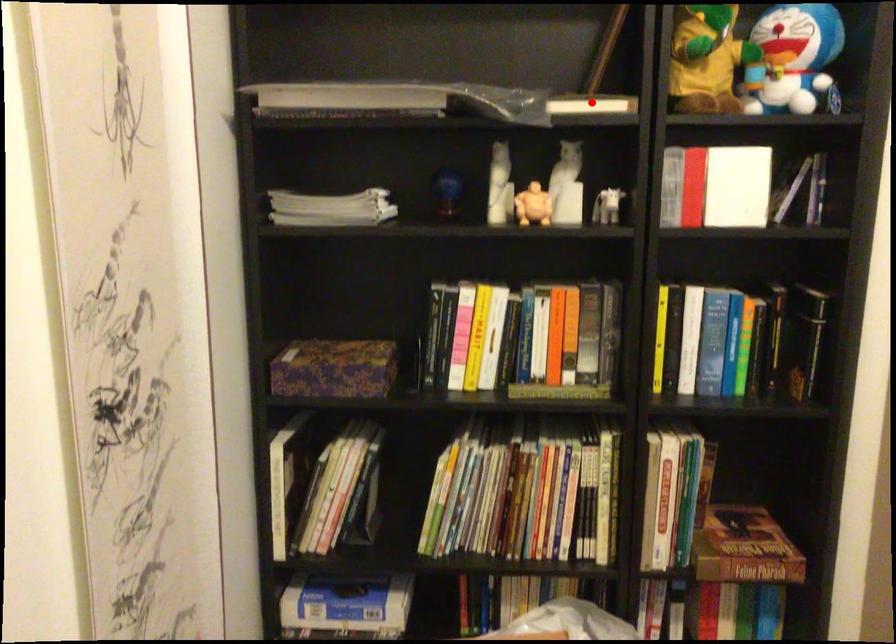
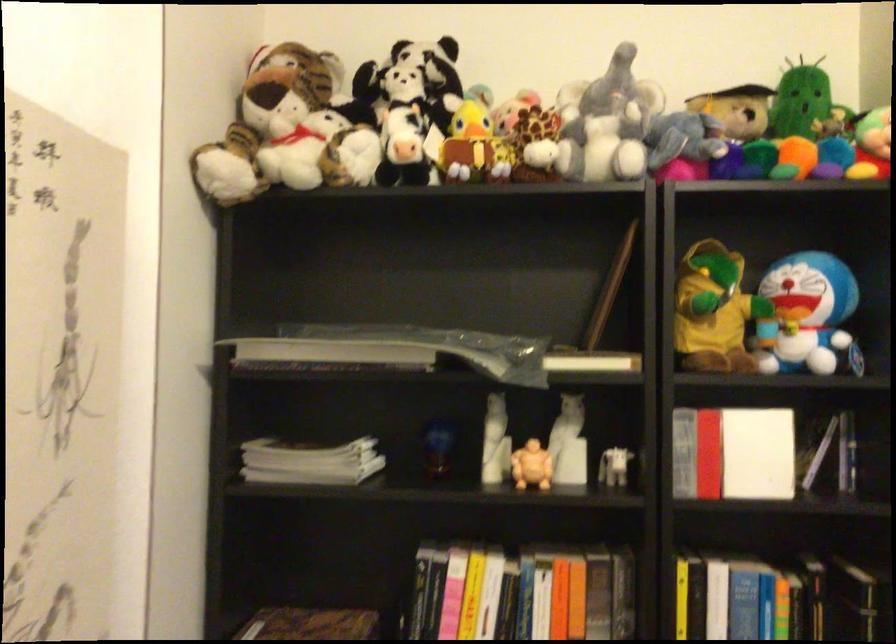
Where in the second image is the point corresponding to the highlighted location from the first image?

(591, 361)